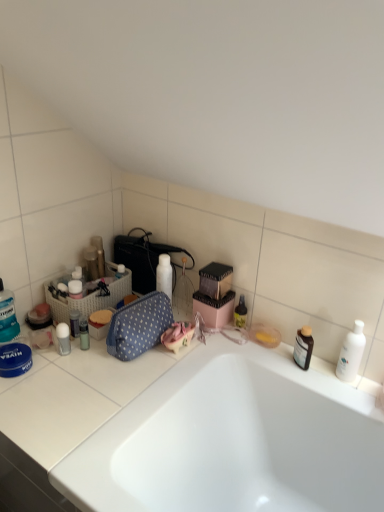
The width and height of the screenshot is (384, 512). In order to click on free space above white woven laundry basket at left (from a real-world perspective) in this screenshot , I will do `click(91, 281)`.